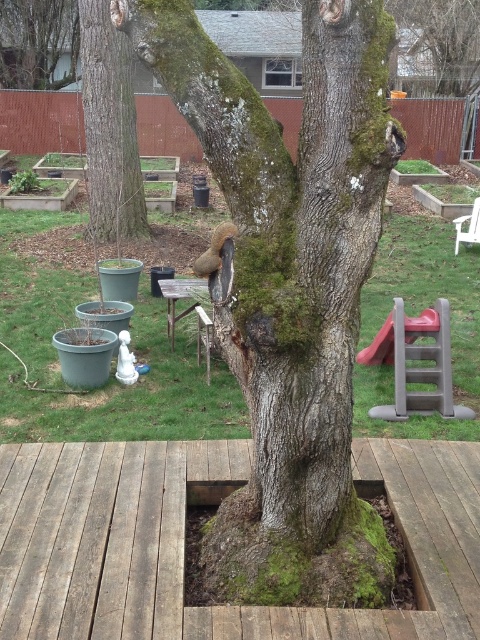
You are standing on the weathered wood deck at center and want to move towards the green mossy bark tree at center. Which direction should you walk to reach it?

The green mossy bark tree at center is to the right of the weathered wood deck at center, so you should walk to the right to reach it.

Based on the photo, you are planning to place a small bench next to the green mossy tree trunk at center and the wooden picnic table at center. Which object requires more space around it for the bench to fit comfortably?

The green mossy tree trunk at center might require more space because it is wider than the wooden picnic table at center according to the description.